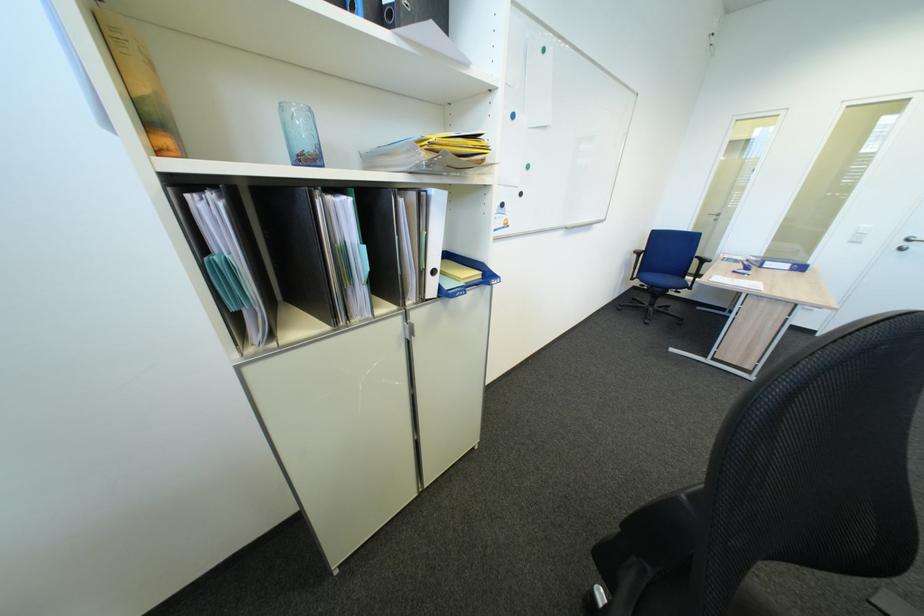
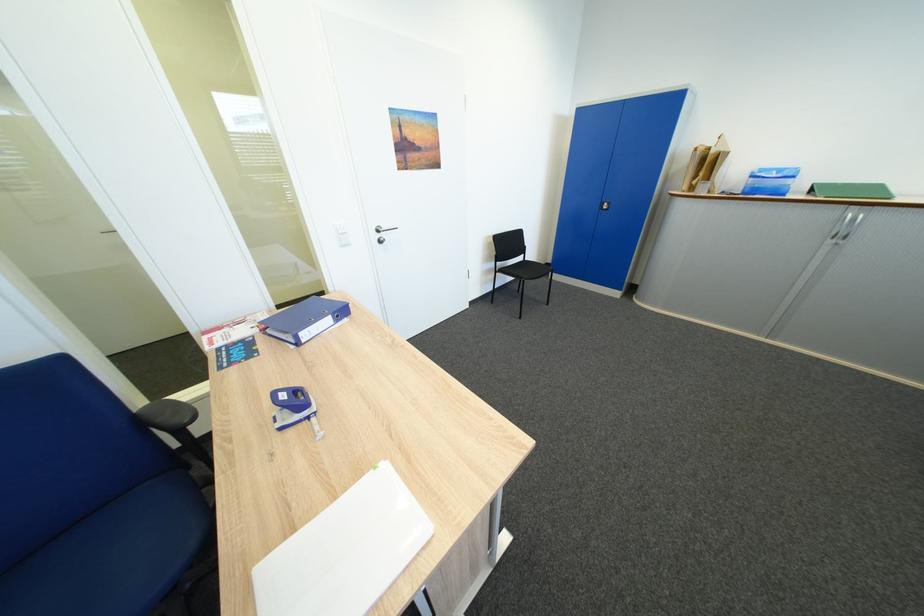
Find the pixel in the second image that matches (776,264) in the first image.

(310, 334)